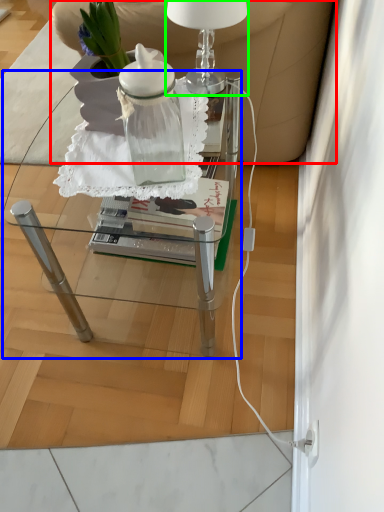
Question: Considering the real-world distances, which object is farthest from armchair (highlighted by a red box)? table (highlighted by a blue box) or table lamp (highlighted by a green box)?

Choices:
 (A) table
 (B) table lamp

Answer: (A)